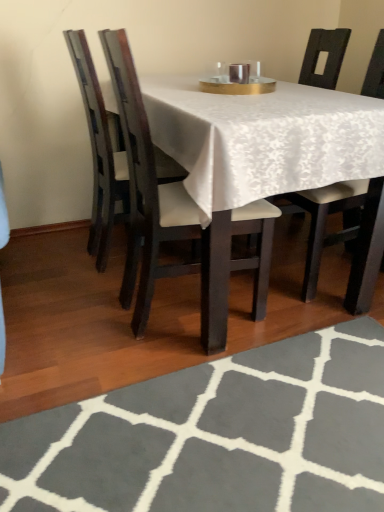
Question: Considering the relative sizes of white fabric chair at center, the third chair positioned from the left, and dark wood chair at center, the second chair positioned from the left, in the image provided, is white fabric chair at center, the third chair positioned from the left, thinner than dark wood chair at center, the second chair positioned from the left,?

Choices:
 (A) yes
 (B) no

Answer: (B)

Question: Is dark wood chair at center, which is the 2th chair in right-to-left order, surrounded by white fabric chair at center, which is counted as the first chair, starting from the right?

Choices:
 (A) no
 (B) yes

Answer: (A)

Question: Is white fabric chair at center, which is counted as the first chair, starting from the right, at the right side of dark wood chair at center, the second chair positioned from the left?

Choices:
 (A) no
 (B) yes

Answer: (B)

Question: Is white fabric chair at center, the third chair positioned from the left, placed right next to dark wood chair at center, the second chair positioned from the left?

Choices:
 (A) yes
 (B) no

Answer: (B)

Question: From a real-world perspective, is white fabric chair at center, the third chair positioned from the left, positioned under dark wood chair at center, which is the 2th chair in right-to-left order, based on gravity?

Choices:
 (A) yes
 (B) no

Answer: (B)

Question: Is matte black chair at left, arranged as the first chair when viewed from the left, closer to the viewer compared to white fabric chair at center, which is counted as the first chair, starting from the right?

Choices:
 (A) yes
 (B) no

Answer: (B)

Question: Can you confirm if matte black chair at left, arranged as the first chair when viewed from the left, is positioned to the left of white fabric chair at center, the third chair positioned from the left?

Choices:
 (A) no
 (B) yes

Answer: (B)

Question: Is matte black chair at left, arranged as the first chair when viewed from the left, wider than white fabric chair at center, which is counted as the first chair, starting from the right?

Choices:
 (A) no
 (B) yes

Answer: (A)

Question: Can you confirm if matte black chair at left, arranged as the first chair when viewed from the left, is bigger than white fabric chair at center, which is counted as the first chair, starting from the right?

Choices:
 (A) yes
 (B) no

Answer: (B)

Question: Is matte black chair at left, arranged as the first chair when viewed from the left, with white fabric chair at center, which is counted as the first chair, starting from the right?

Choices:
 (A) no
 (B) yes

Answer: (A)

Question: From a real-world perspective, is matte black chair at left, arranged as the first chair when viewed from the left, located beneath white fabric chair at center, the third chair positioned from the left?

Choices:
 (A) no
 (B) yes

Answer: (B)

Question: Considering the relative sizes of gray woolen rug at lower center and white fabric chair at center, which is counted as the first chair, starting from the right, in the image provided, is gray woolen rug at lower center thinner than white fabric chair at center, which is counted as the first chair, starting from the right,?

Choices:
 (A) no
 (B) yes

Answer: (A)